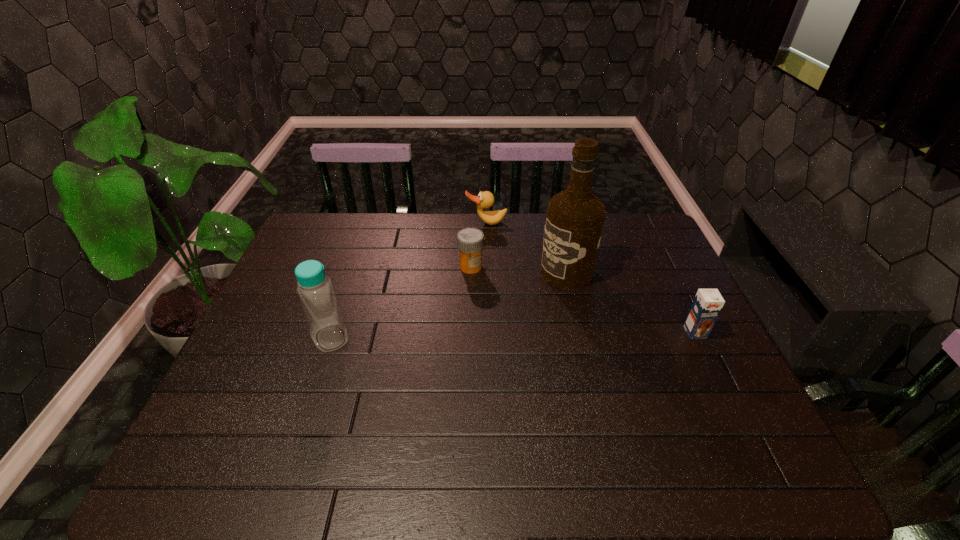
Identify the location of free spot that satisfies the following two spatial constraints: 1. on the back side of the second tallest object; 2. on the left side of the medicine. The height and width of the screenshot is (540, 960). (354, 267).